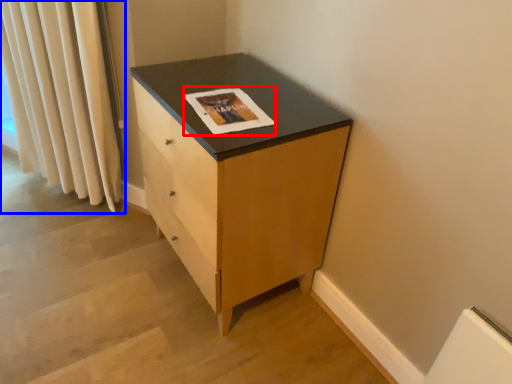
Question: Which object is further to the camera taking this photo, magazine (highlighted by a red box) or curtain (highlighted by a blue box)?

Choices:
 (A) magazine
 (B) curtain

Answer: (B)